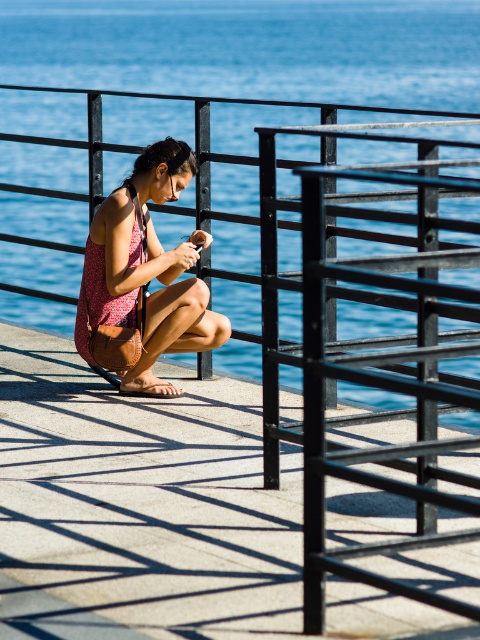
You are a photographer trying to capture a closeup of the shadows on the concrete. You have a camera bag that can only hold one object at a time. Which object should you move first to get a better angle, the matte leather dock at center or the matte brown purse at center?

The matte leather dock at center is shorter than the matte brown purse at center. Since the dock is shorter, moving it first would allow you to adjust the lower obstruction before dealing with the taller purse.